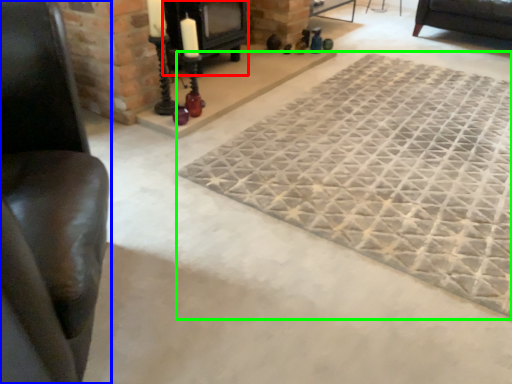
Question: Estimate the real-world distances between objects in this image. Which object is closer to fireplace (highlighted by a red box), furniture (highlighted by a blue box) or mat (highlighted by a green box)?

Choices:
 (A) furniture
 (B) mat

Answer: (B)